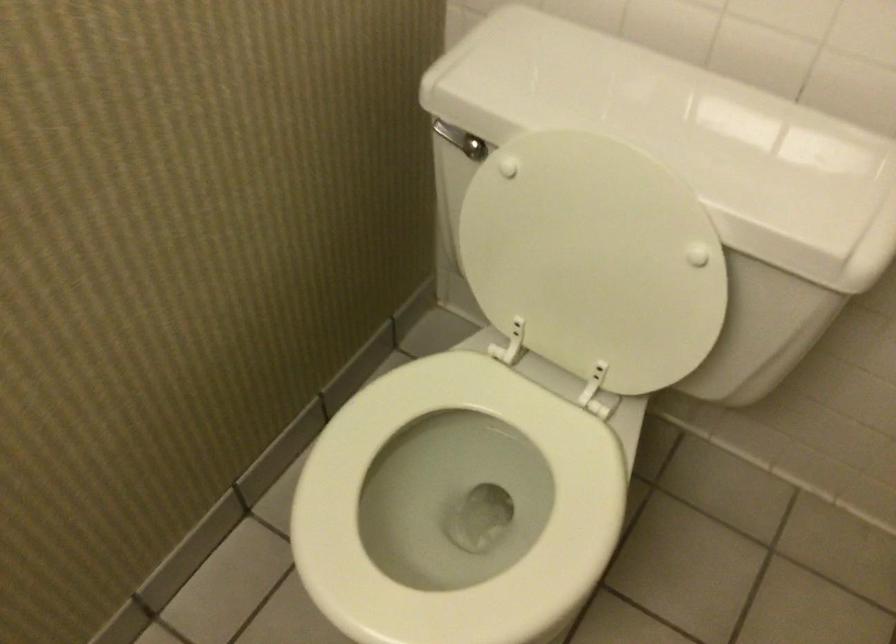
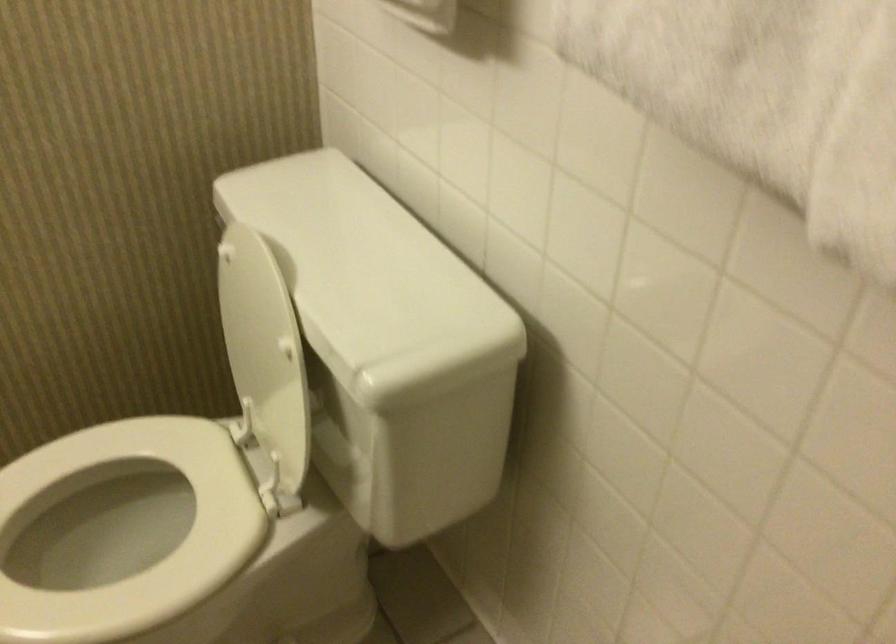
Where in the second image is the point corresponding to point (597, 256) from the first image?

(259, 343)